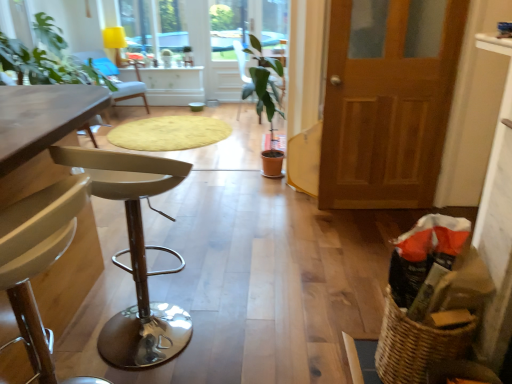
Find the location of a particular element. Image resolution: width=512 pixels, height=384 pixels. vacant region to the right of metallic silver stool at left, the second chair when ordered from left to right is located at coordinates (237, 327).